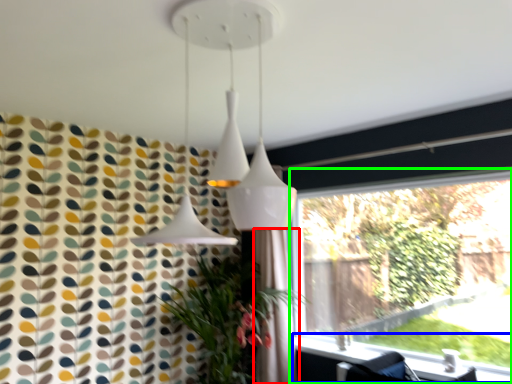
Question: Which is nearer to the shower curtain (highlighted by a red box)? window sill (highlighted by a blue box) or window (highlighted by a green box).

Choices:
 (A) window sill
 (B) window

Answer: (A)